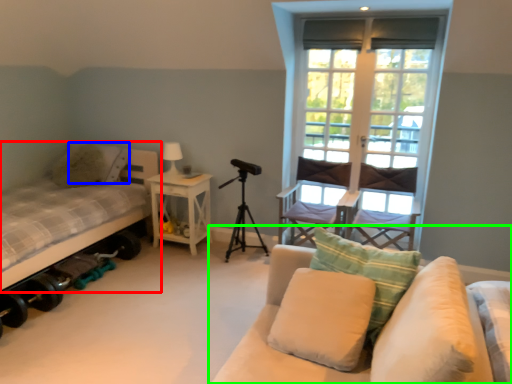
Question: Which object is the farthest from bed (highlighted by a red box)? Choose among these: pillow (highlighted by a blue box) or studio couch (highlighted by a green box).

Choices:
 (A) pillow
 (B) studio couch

Answer: (B)